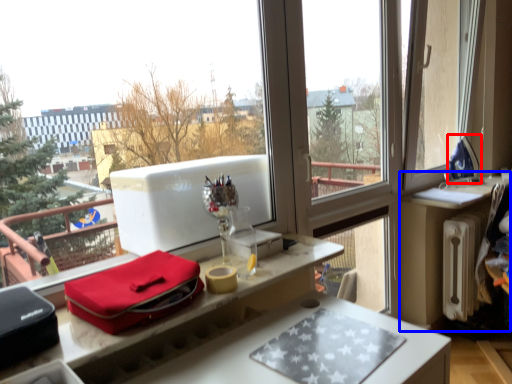
Question: Which object appears closest to the camera in this image, appliance (highlighted by a red box) or table (highlighted by a blue box)?

Choices:
 (A) appliance
 (B) table

Answer: (B)